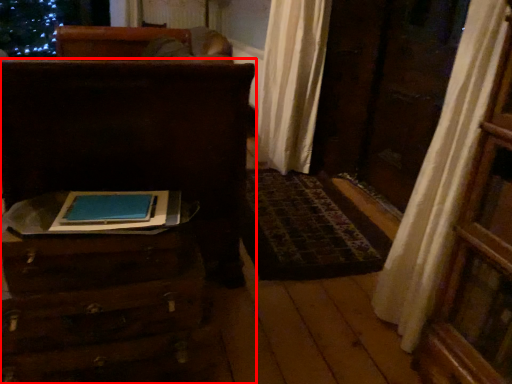
Question: From the image, what is the correct spatial relationship of furniture (annotated by the red box) in relation to furniture?

Choices:
 (A) right
 (B) left

Answer: (B)